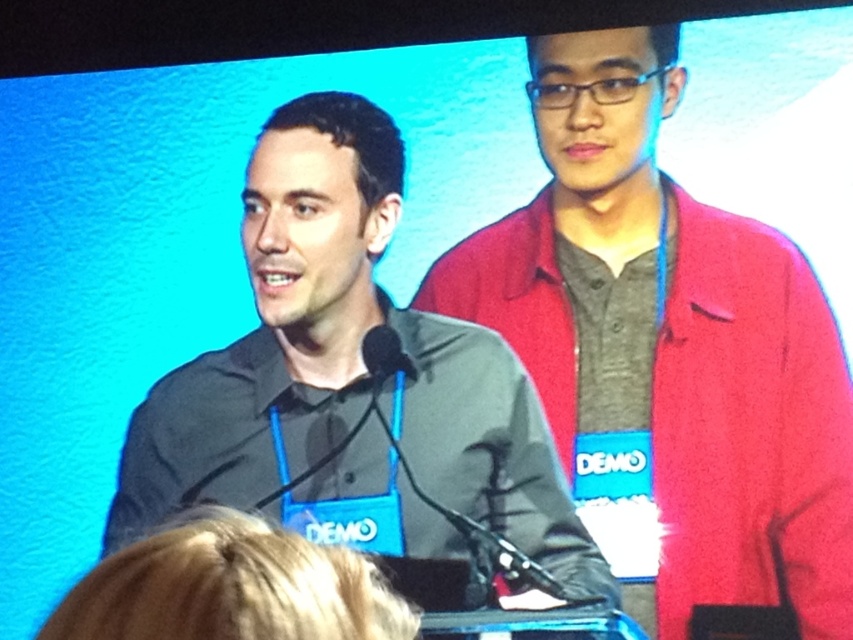
You are organizing a photo shoot and need to position two models according to the scene. The models are wearing a matte red jacket at center and a black matte shirt at center. Based on their positions, which model should stand on your left side to mirror the original scene?

The model wearing the black matte shirt at center should stand on your left side because the matte red jacket at center is to the right of the black matte shirt at center in the original scene.

You are a photographer at the event and need to capture a clear photo of both the matte red jacket at center and the black matte shirt at center. Since the background is blue, which object should you focus on first to ensure both are in focus?

The matte red jacket at center is in front of the black matte shirt at center, so you should focus on the matte red jacket at center first to ensure both are in focus.

You are a photographer standing 5 feet away from the two people at the podium. You want to take a photo that includes both the matte red jacket at center and the black matte shirt at center. Can you fit both subjects in the frame without zooming in? The camera you are using has a field of view of 6 feet at this distance.

The distance between the matte red jacket at center and the black matte shirt at center is 14.15 inches. Since the camera has a field of view of 6 feet at 5 feet away, which is 72 inches, the 14.15 inches between them is well within the 72 inches field of view. Therefore, both subjects can easily fit in the frame without zooming in.